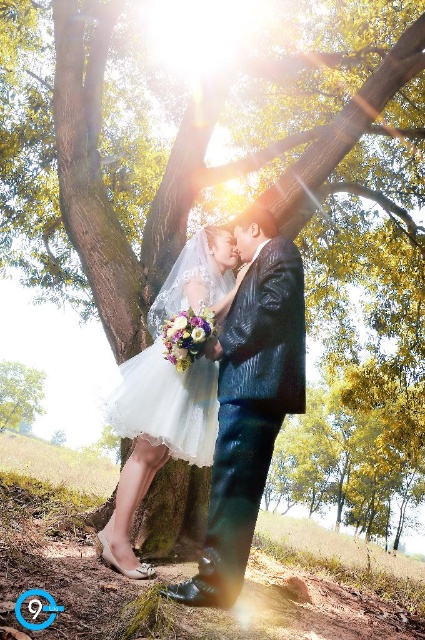
Question: Which point appears farthest from the camera in this image?

Choices:
 (A) (133, 358)
 (B) (6, 408)
 (C) (204, 600)

Answer: (B)

Question: Is shiny dark blue suit at center smaller than matte white dress at center?

Choices:
 (A) yes
 (B) no

Answer: (A)

Question: Is matte white dress at center bigger than green leafy tree at lower left?

Choices:
 (A) no
 (B) yes

Answer: (A)

Question: Which object is the closest to the shiny dark blue suit at center?

Choices:
 (A) green leafy tree at lower left
 (B) matte white dress at center

Answer: (B)

Question: Which point is closer to the camera?

Choices:
 (A) (158, 435)
 (B) (249, 305)

Answer: (B)

Question: Does matte white dress at center appear on the right side of green leafy tree at lower left?

Choices:
 (A) no
 (B) yes

Answer: (B)